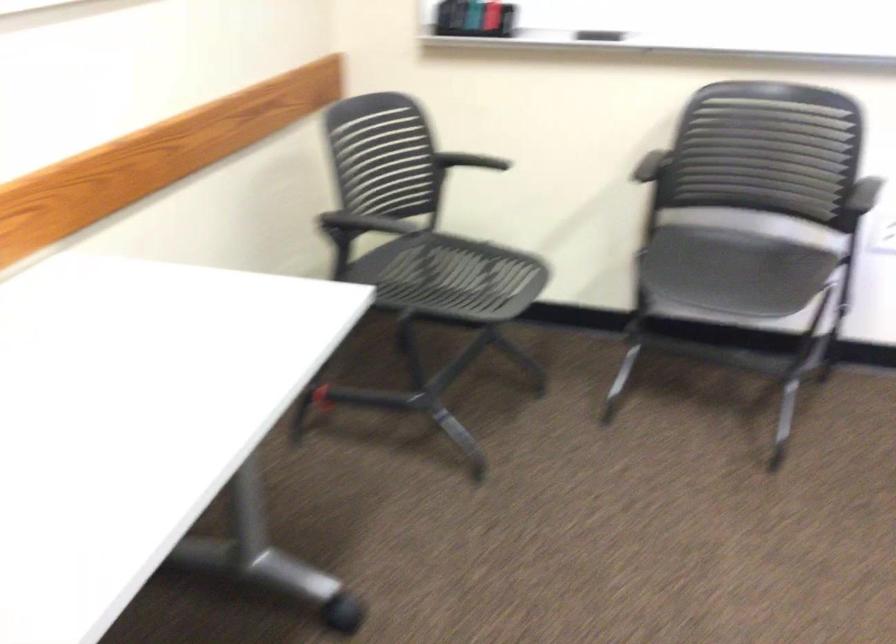
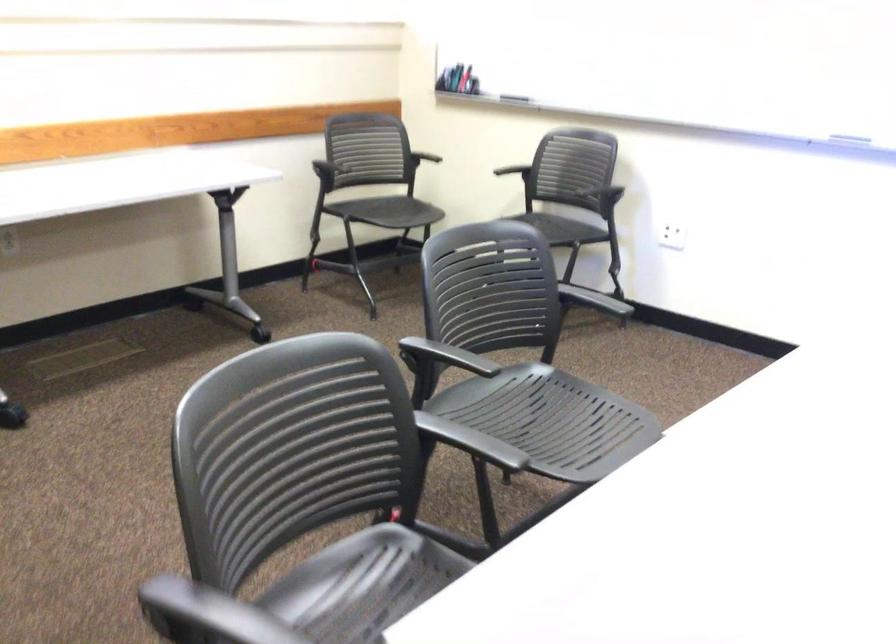
The point at [470,161] is marked in the first image. Where is the corresponding point in the second image?

(425, 147)